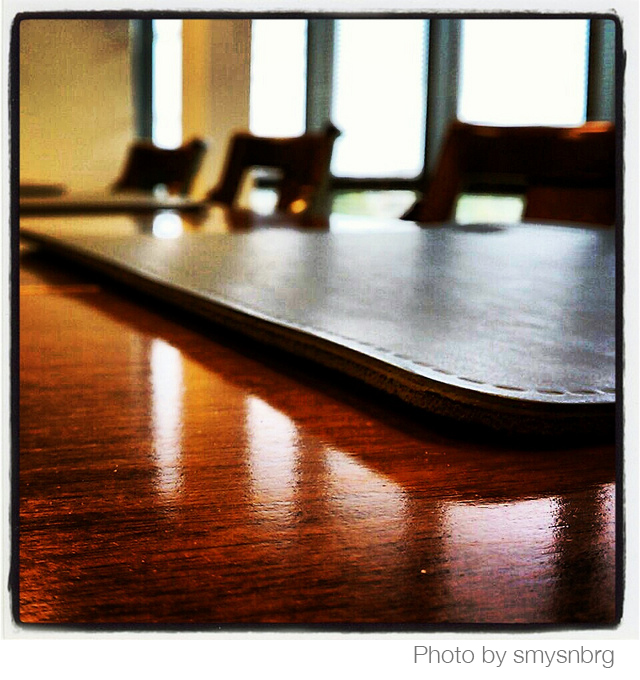
Identify the location of table. (76, 513).